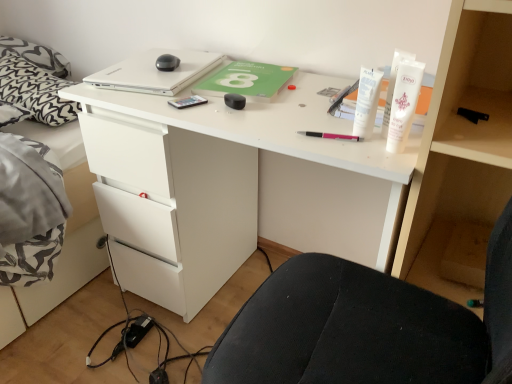
Where is `vacant space that is to the left of satin silver phone at center, positioned as the 1th stationery in left-to-right order`? The width and height of the screenshot is (512, 384). vacant space that is to the left of satin silver phone at center, positioned as the 1th stationery in left-to-right order is located at coordinates (140, 102).